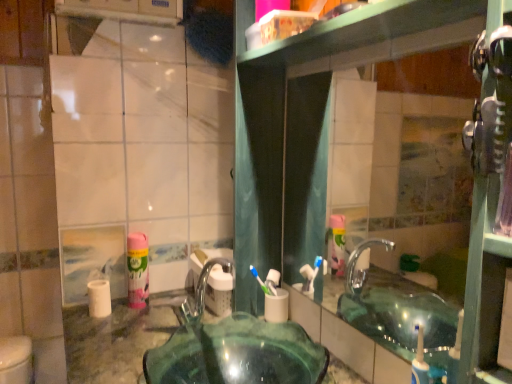
At what (x,y) coordinates should I click in order to perform the action: click on vacant space to the right of pink matte mouthwash at left. Please return your answer as a coordinate pair (x, y). The height and width of the screenshot is (384, 512). Looking at the image, I should click on (169, 308).